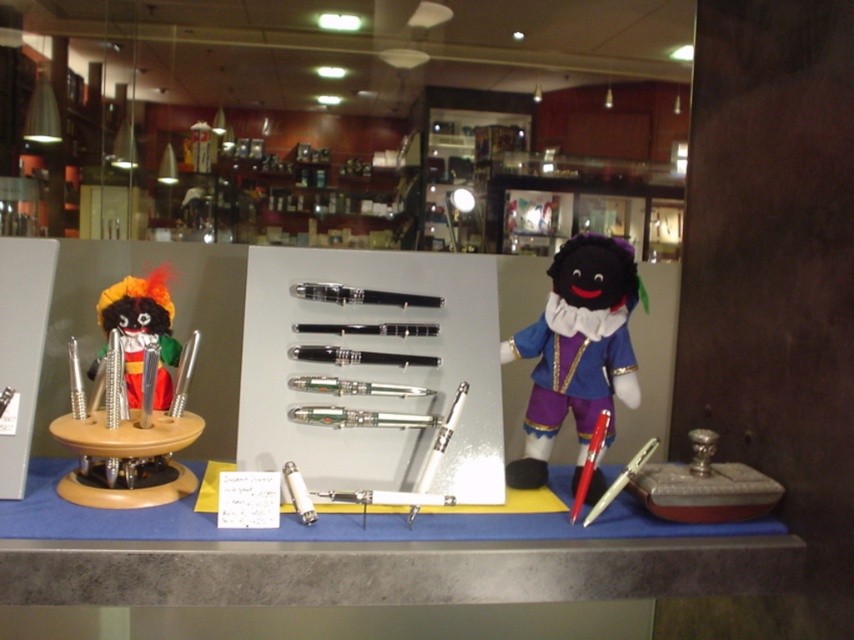
You are a customer trying to place a small gift box on the blue fabric table at center. The velvet doll at center is also on the table. Can the gift box fit on the table without overlapping the doll?

The blue fabric table at center has a larger width than the velvet doll at center, so there is enough space to place the gift box without overlapping the doll.

You are standing in front of a display case in a pen store. There is a point marked at coordinates point (x=28, y=490). Can you reach this point with your hand if you are 1.50 meters away from the display case?

The point (x=28, y=490) is 1.50 meters away from the viewer, so yes, you can reach it with your hand since you are exactly at that distance.

Based on the scene description, which object is thinner, the wooden toy at left or the velvet doll at center?

The wooden toy at left is thinner than the velvet doll at center.